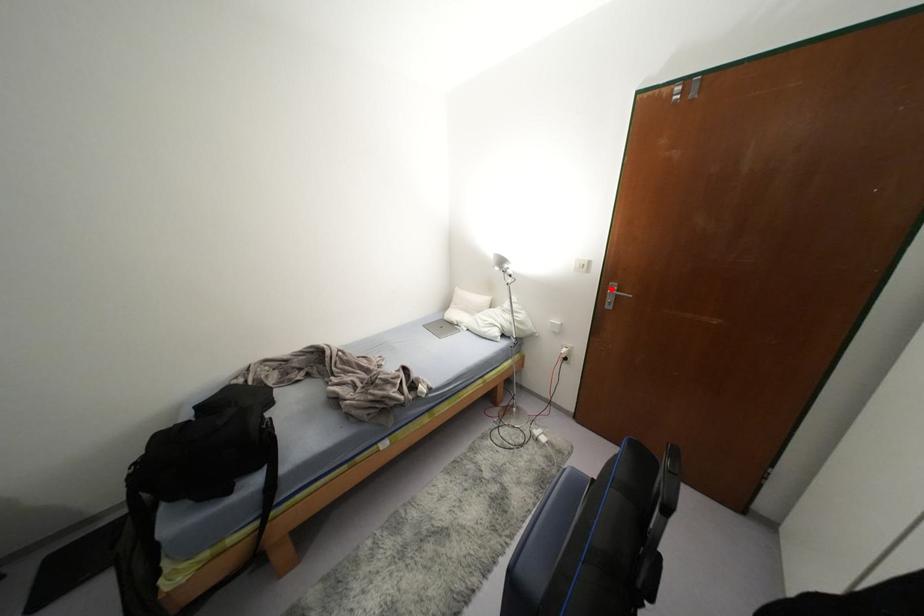
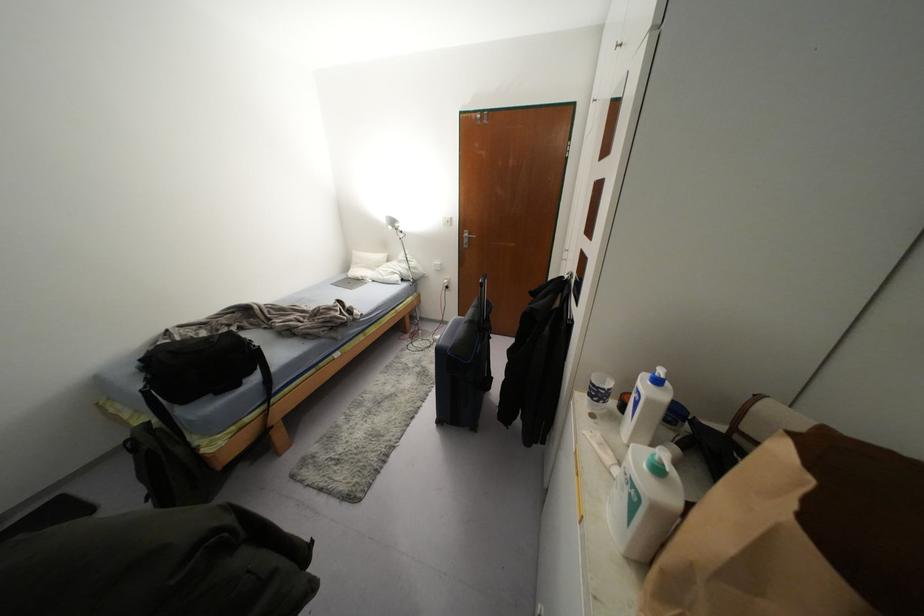
Question: I am providing you with two images of the same scene from different viewpoints. Image1 has a red point marked. In image2, the corresponding 3D location appears at what relative position? Reply with the corresponding letter.

Choices:
 (A) Closer
 (B) Farther

Answer: (A)